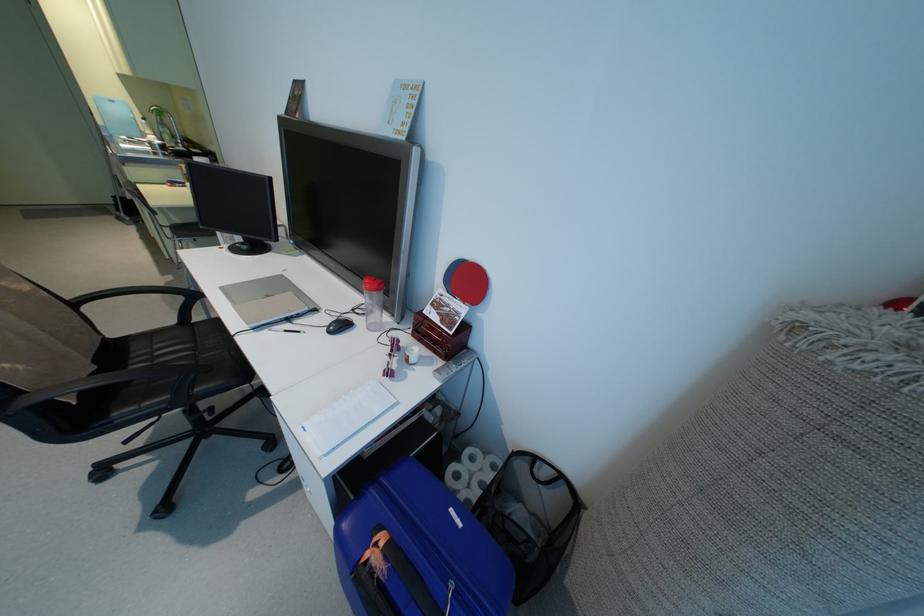
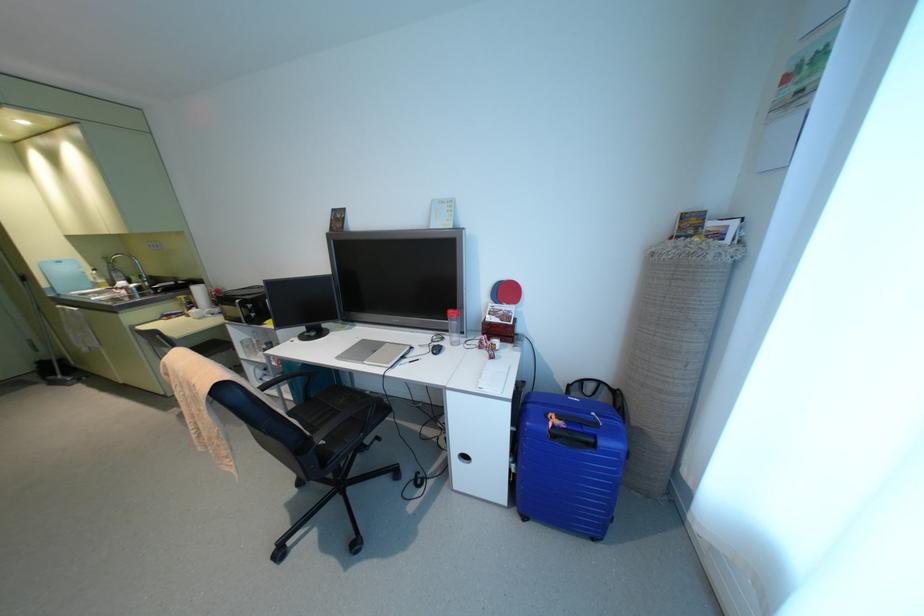
In the second image, find the point that corresponds to the point at 463,299 in the first image.

(507, 302)